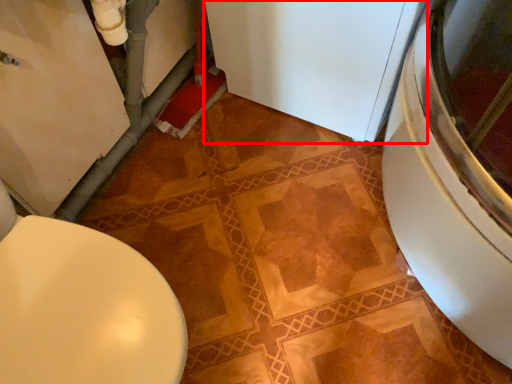
Question: From the image, what is the correct spatial relationship of appliance (annotated by the red box) in relation to toilet?

Choices:
 (A) right
 (B) left

Answer: (A)